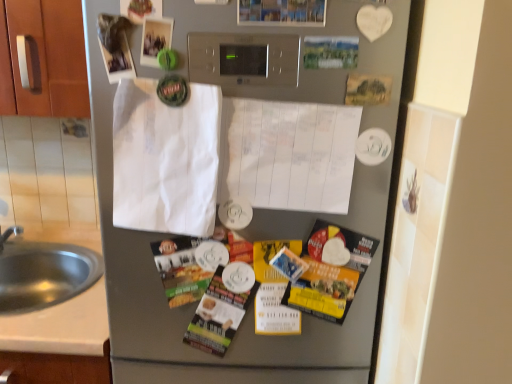
Question: Does satin silver refrigerator at center have a greater width compared to matte paper magazine at center, the second magazine when ordered from right to left?

Choices:
 (A) yes
 (B) no

Answer: (B)

Question: Can you confirm if satin silver refrigerator at center is smaller than matte paper magazine at center, placed as the first magazine when sorted from left to right?

Choices:
 (A) yes
 (B) no

Answer: (B)

Question: From the image's perspective, is satin silver refrigerator at center beneath matte paper magazine at center, placed as the first magazine when sorted from left to right?

Choices:
 (A) yes
 (B) no

Answer: (B)

Question: Is satin silver refrigerator at center facing towards matte paper magazine at center, the second magazine when ordered from right to left?

Choices:
 (A) yes
 (B) no

Answer: (A)

Question: From a real-world perspective, is satin silver refrigerator at center on matte paper magazine at center, placed as the first magazine when sorted from left to right?

Choices:
 (A) yes
 (B) no

Answer: (A)

Question: Is satin silver refrigerator at center outside of matte paper magazine at center, the second magazine when ordered from right to left?

Choices:
 (A) no
 (B) yes

Answer: (B)

Question: Would you say white paper at center is outside brushed metal sink at lower left?

Choices:
 (A) yes
 (B) no

Answer: (A)

Question: Can you confirm if white paper at center is wider than brushed metal sink at lower left?

Choices:
 (A) no
 (B) yes

Answer: (A)

Question: Would you consider white paper at center to be distant from brushed metal sink at lower left?

Choices:
 (A) yes
 (B) no

Answer: (B)

Question: Can you confirm if white paper at center is smaller than brushed metal sink at lower left?

Choices:
 (A) no
 (B) yes

Answer: (B)

Question: Considering the relative sizes of white paper at center and brushed metal sink at lower left in the image provided, is white paper at center shorter than brushed metal sink at lower left?

Choices:
 (A) no
 (B) yes

Answer: (A)

Question: Is white paper at center in contact with brushed metal sink at lower left?

Choices:
 (A) no
 (B) yes

Answer: (A)

Question: Is yellow paper flyer at lower right thinner than brushed metal sink at lower left?

Choices:
 (A) yes
 (B) no

Answer: (A)